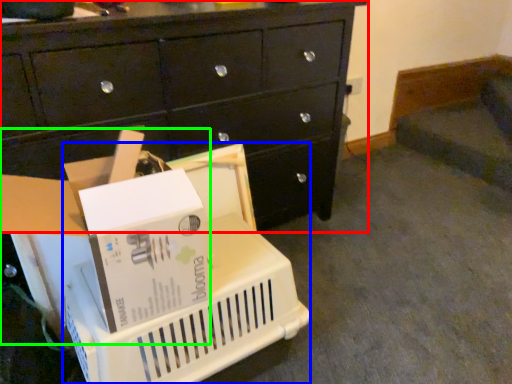
Question: Which object is positioned farthest from chest of drawers (highlighted by a red box)? Select from basket (highlighted by a blue box) and storage box (highlighted by a green box).

Choices:
 (A) basket
 (B) storage box

Answer: (B)